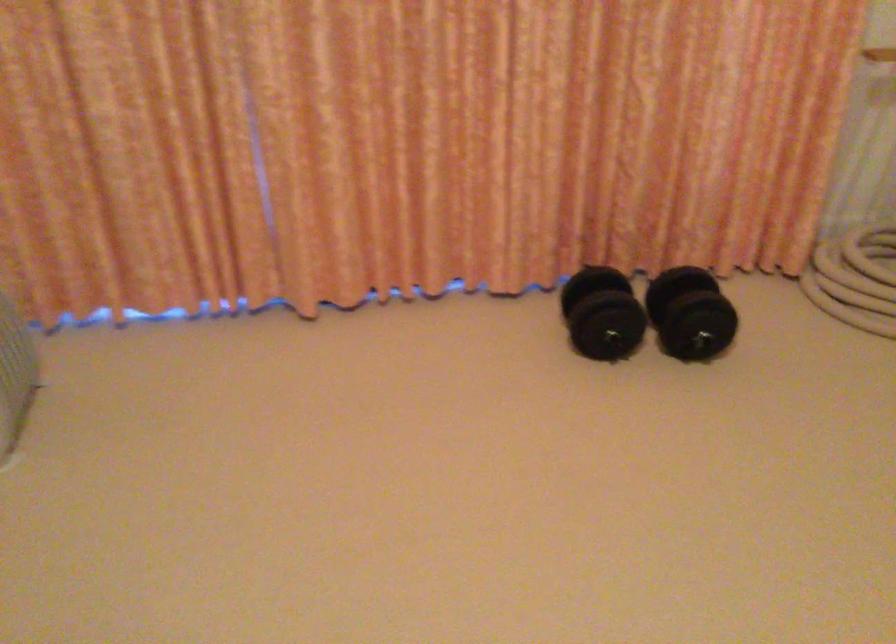
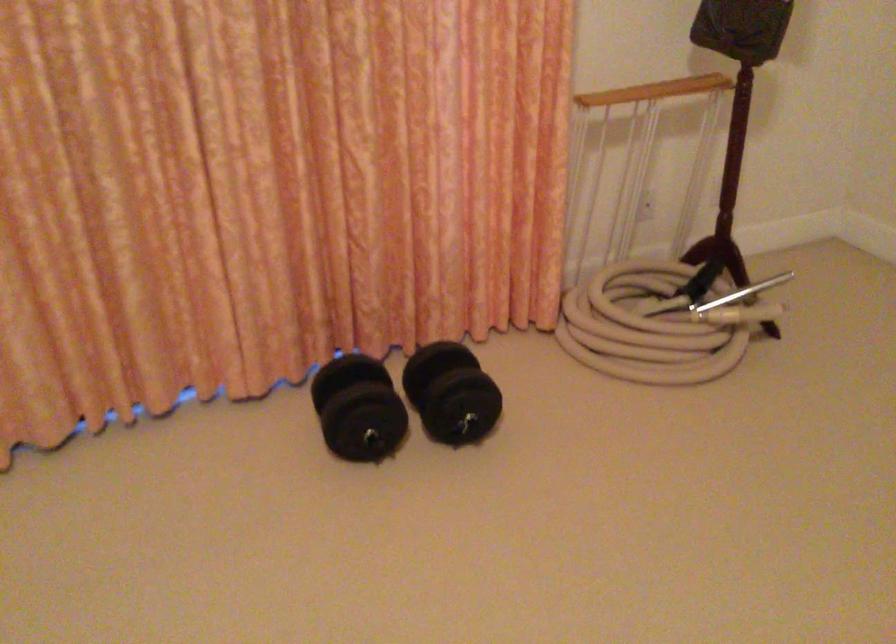
Question: The images are taken continuously from a first-person perspective. In which direction are you moving?

Choices:
 (A) Left
 (B) Right
 (C) Forward
 (D) Backward

Answer: (C)